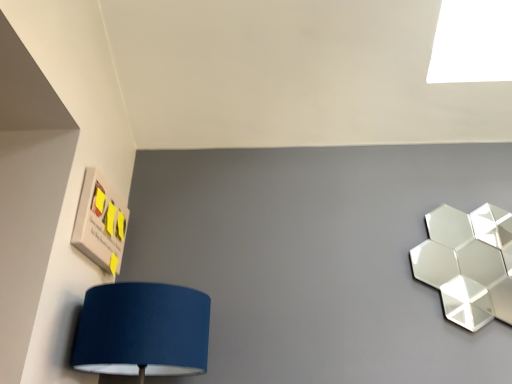
Question: Is the depth of white glossy light at upper right less than that of shiny metallic hexagonal at upper right?

Choices:
 (A) yes
 (B) no

Answer: (B)

Question: Is white glossy light at upper right placed right next to shiny metallic hexagonal at upper right?

Choices:
 (A) yes
 (B) no

Answer: (B)

Question: Does white glossy light at upper right appear on the left side of shiny metallic hexagonal at upper right?

Choices:
 (A) no
 (B) yes

Answer: (A)

Question: From a real-world perspective, is white glossy light at upper right physically above shiny metallic hexagonal at upper right?

Choices:
 (A) yes
 (B) no

Answer: (A)

Question: Is white glossy light at upper right smaller than shiny metallic hexagonal at upper right?

Choices:
 (A) yes
 (B) no

Answer: (B)

Question: From a real-world perspective, does white glossy light at upper right sit lower than shiny metallic hexagonal at upper right?

Choices:
 (A) no
 (B) yes

Answer: (A)

Question: Is shiny metallic hexagonal at upper right oriented away from white glossy light at upper right?

Choices:
 (A) no
 (B) yes

Answer: (A)

Question: Considering the relative sizes of shiny metallic hexagonal at upper right and white glossy light at upper right in the image provided, is shiny metallic hexagonal at upper right taller than white glossy light at upper right?

Choices:
 (A) yes
 (B) no

Answer: (A)

Question: Is the position of shiny metallic hexagonal at upper right more distant than that of white glossy light at upper right?

Choices:
 (A) yes
 (B) no

Answer: (B)

Question: Does shiny metallic hexagonal at upper right appear on the left side of white glossy light at upper right?

Choices:
 (A) yes
 (B) no

Answer: (A)

Question: Does shiny metallic hexagonal at upper right have a smaller size compared to white glossy light at upper right?

Choices:
 (A) no
 (B) yes

Answer: (B)

Question: Is shiny metallic hexagonal at upper right next to white glossy light at upper right?

Choices:
 (A) no
 (B) yes

Answer: (A)

Question: Considering the relative sizes of matte wood sign with sticky notes at upper left and shiny metallic hexagonal at upper right in the image provided, is matte wood sign with sticky notes at upper left bigger than shiny metallic hexagonal at upper right?

Choices:
 (A) yes
 (B) no

Answer: (B)